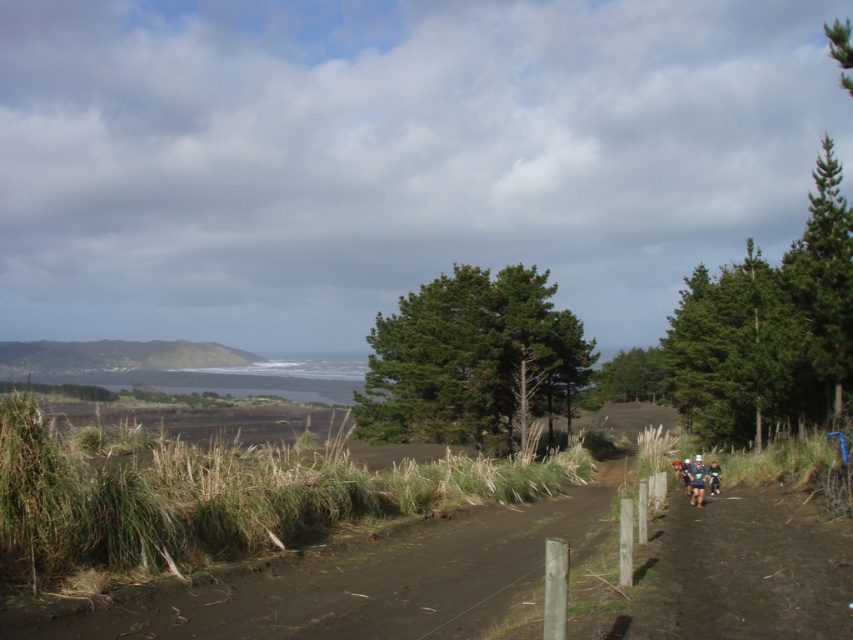
Is the position of brown sandy hill at left less distant than that of dark green jersey at center-right?

No, it is behind dark green jersey at center-right.

Which is more to the right, brown sandy hill at left or dark green jersey at center-right?

From the viewer's perspective, dark green jersey at center-right appears more on the right side.

Which is in front, point (151, 355) or point (692, 481)?

Positioned in front is point (692, 481).

This screenshot has width=853, height=640. I want to click on brown sandy hill at left, so click(117, 355).